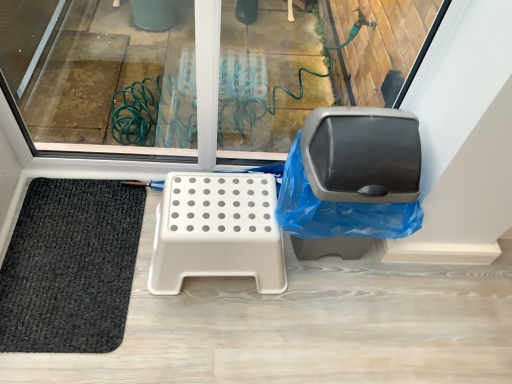
Image resolution: width=512 pixels, height=384 pixels. Identify the location of free space in front of beige plastic step stool at center. (195, 338).